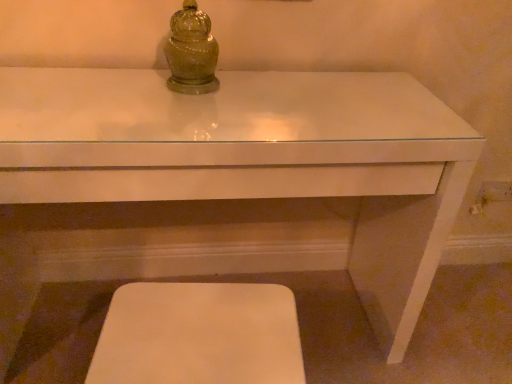
Find the location of a particular element. The width and height of the screenshot is (512, 384). white glossy table at center is located at coordinates (255, 158).

Measure the distance between point (205, 324) and camera.

The depth of point (205, 324) is 34.09 inches.

I want to click on green glass jar at upper center, so click(191, 52).

Measure the distance from white matte step stool at lower center to green glass jar at upper center.

white matte step stool at lower center and green glass jar at upper center are 21.92 inches apart from each other.

Is point (239, 339) positioned behind point (201, 33)?

No, it is in front of (201, 33).

Is white matte step stool at lower center completely or partially outside of green glass jar at upper center?

Yes, white matte step stool at lower center is located beyond the bounds of green glass jar at upper center.

Is white matte step stool at lower center wider than green glass jar at upper center?

Indeed, white matte step stool at lower center has a greater width compared to green glass jar at upper center.

Is green glass jar at upper center not within white glossy table at center?

green glass jar at upper center is positioned outside white glossy table at center.

Considering the relative positions of green glass jar at upper center and white glossy table at center in the image provided, is green glass jar at upper center to the left of white glossy table at center from the viewer's perspective?

Incorrect, green glass jar at upper center is not on the left side of white glossy table at center.

Which is in front, point (187, 12) or point (298, 163)?

The point (298, 163) is more forward.

Considering the relative sizes of green glass jar at upper center and white glossy table at center in the image provided, is green glass jar at upper center thinner than white glossy table at center?

Indeed, green glass jar at upper center has a lesser width compared to white glossy table at center.

Where is `step stool lying below the green glass jar at upper center (from the image's perspective)`? This screenshot has width=512, height=384. step stool lying below the green glass jar at upper center (from the image's perspective) is located at coordinates (199, 335).

From the image's perspective, is green glass jar at upper center above or below white matte step stool at lower center?

green glass jar at upper center is situated higher than white matte step stool at lower center in the image.

Which of these two, green glass jar at upper center or white matte step stool at lower center, is thinner?

green glass jar at upper center.

Does green glass jar at upper center have a greater height compared to white matte step stool at lower center?

Incorrect, the height of green glass jar at upper center is not larger of that of white matte step stool at lower center.

Is point (261, 364) more distant than point (350, 144)?

No, it is not.

In the scene shown: In the image, is white matte step stool at lower center positioned in front of or behind white glossy table at center?

In the image, white matte step stool at lower center appears in front of white glossy table at center.

From the image's perspective, is white matte step stool at lower center positioned above or below white glossy table at center?

white matte step stool at lower center is below white glossy table at center.

Based on their positions, is white glossy table at center located to the left or right of green glass jar at upper center?

white glossy table at center is to the left of green glass jar at upper center.

Is point (392, 203) in front of point (216, 47)?

No, (392, 203) is behind (216, 47).

Is white glossy table at center not within green glass jar at upper center?

Absolutely, white glossy table at center is external to green glass jar at upper center.

How many degrees apart are the facing directions of white glossy table at center and white matte step stool at lower center?

0.178 degrees separate the facing orientations of white glossy table at center and white matte step stool at lower center.

This screenshot has height=384, width=512. Identify the location of step stool below the white glossy table at center (from the image's perspective). (199, 335).

From the picture: In terms of height, does white glossy table at center look taller or shorter compared to white matte step stool at lower center?

Clearly, white glossy table at center is taller compared to white matte step stool at lower center.

Does white glossy table at center contain white matte step stool at lower center?

No, white matte step stool at lower center is located outside of white glossy table at center.

The image size is (512, 384). Find the location of `candle holder above the white matte step stool at lower center (from a real-world perspective)`. candle holder above the white matte step stool at lower center (from a real-world perspective) is located at coordinates (191, 52).

Identify the location of candle holder that is above the white glossy table at center (from the image's perspective). (191, 52).

Which object lies further to the anchor point white glossy table at center, white matte step stool at lower center or green glass jar at upper center?

white matte step stool at lower center.

Considering their positions, is white matte step stool at lower center positioned closer to green glass jar at upper center than white glossy table at center?

Based on the image, white glossy table at center appears to be nearer to green glass jar at upper center.

Considering their positions, is green glass jar at upper center positioned closer to white glossy table at center than white matte step stool at lower center?

Among the two, green glass jar at upper center is located nearer to white glossy table at center.

Looking at the image, which one is located further to green glass jar at upper center, white glossy table at center or white matte step stool at lower center?

Based on the image, white matte step stool at lower center appears to be further to green glass jar at upper center.

Based on their spatial positions, is white glossy table at center or green glass jar at upper center closer to white matte step stool at lower center?

white glossy table at center is positioned closer to the anchor white matte step stool at lower center.

From the image, which object appears to be farther from white matte step stool at lower center, green glass jar at upper center or white glossy table at center?

green glass jar at upper center.

At what (x,y) coordinates should I click in order to perform the action: click on table that lies between green glass jar at upper center and white matte step stool at lower center from top to bottom. Please return your answer as a coordinate pair (x, y). This screenshot has width=512, height=384. Looking at the image, I should click on (255, 158).